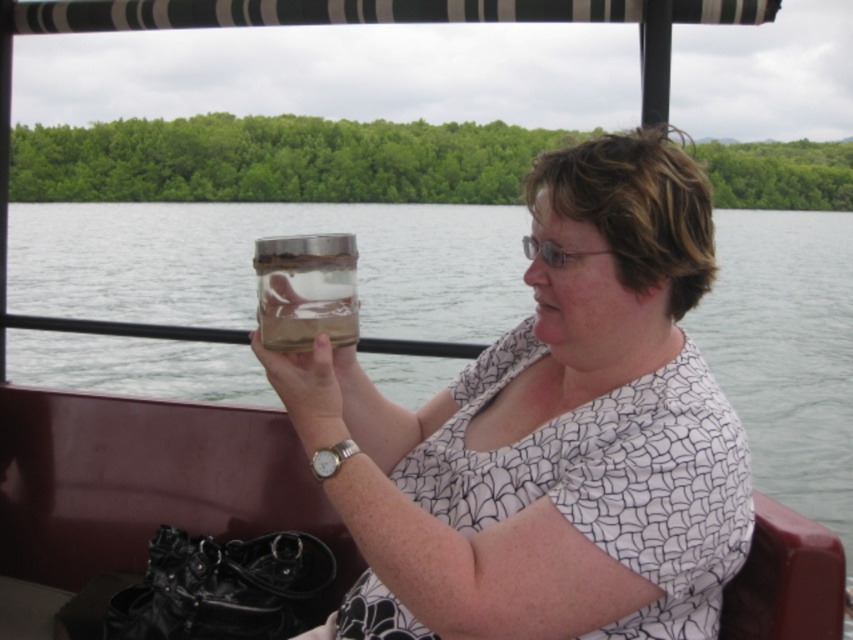
Question: Does clear glass jar at upper center appear under transparent glass jar at center?

Choices:
 (A) no
 (B) yes

Answer: (B)

Question: Which point appears farthest from the camera in this image?

Choices:
 (A) (293, 333)
 (B) (498, 582)

Answer: (A)

Question: Does clear glass jar at upper center have a larger size compared to transparent glass jar at center?

Choices:
 (A) no
 (B) yes

Answer: (B)

Question: Which point appears farthest from the camera in this image?

Choices:
 (A) (322, 477)
 (B) (341, 262)

Answer: (A)

Question: In this image, where is clear glass jar at upper center located relative to transparent glass jar at center?

Choices:
 (A) left
 (B) right

Answer: (B)